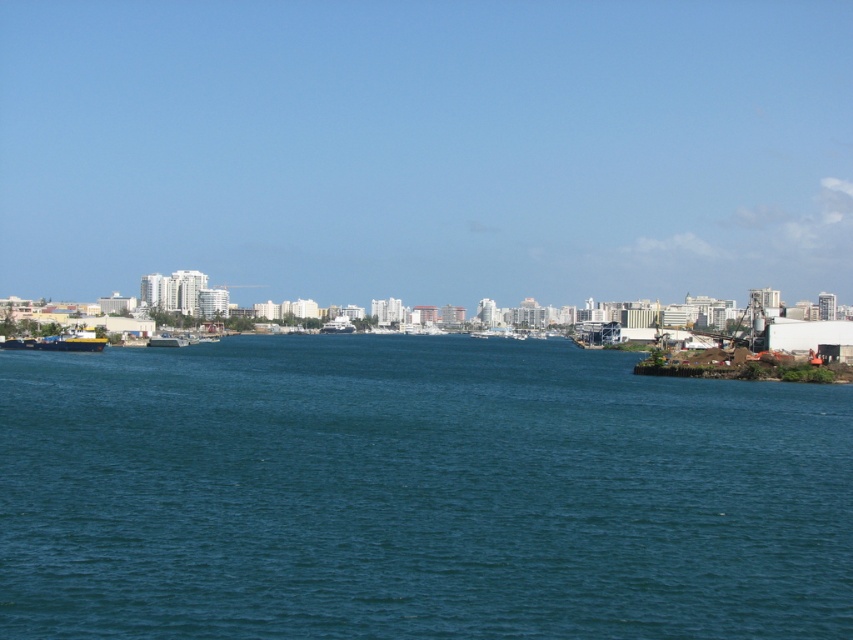
Question: Does teal water at center have a lesser width compared to metallic gray boat at left?

Choices:
 (A) yes
 (B) no

Answer: (B)

Question: Does teal water at center appear under metallic gray boat at left?

Choices:
 (A) yes
 (B) no

Answer: (A)

Question: Does teal water at center have a lesser width compared to metallic gray boat at left?

Choices:
 (A) no
 (B) yes

Answer: (A)